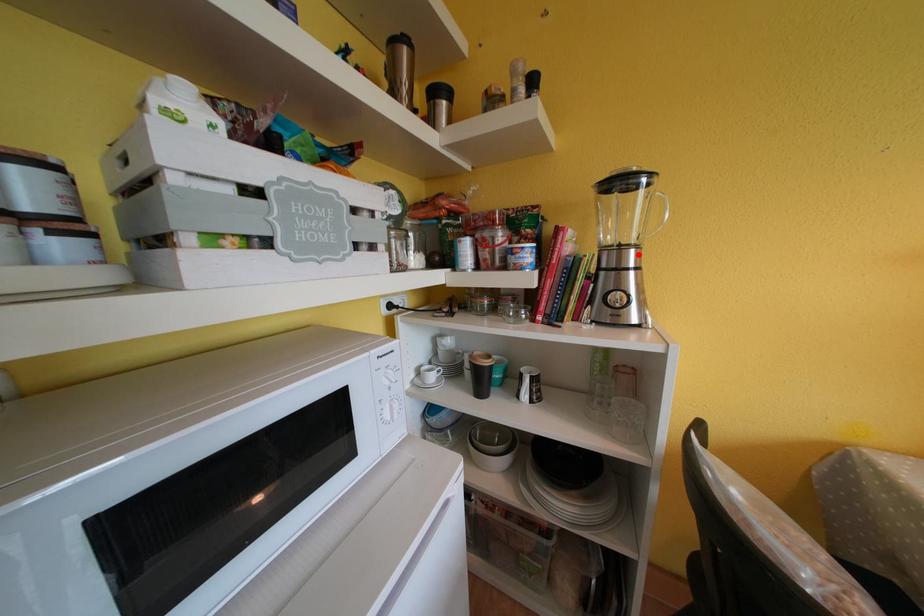
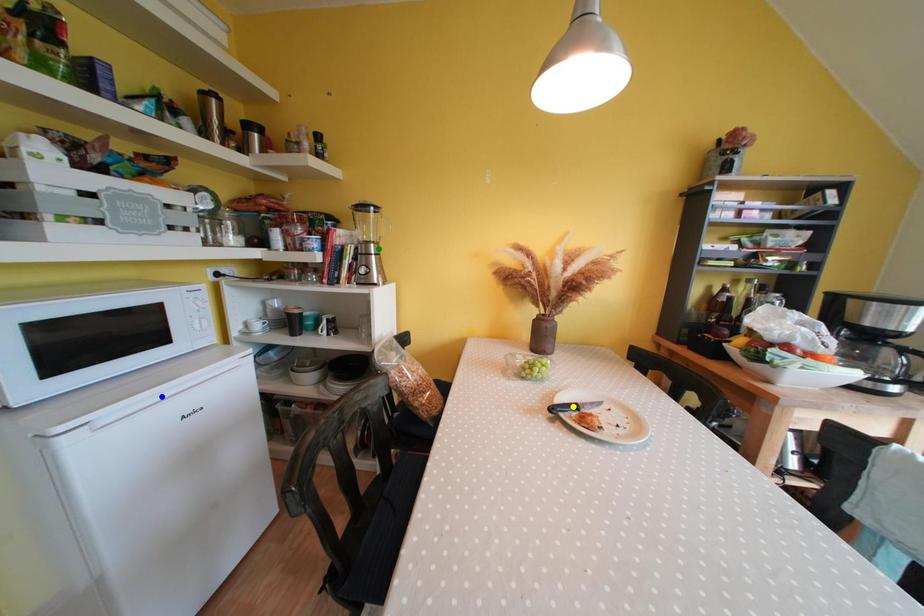
Question: I am providing you with two images of the same scene from different viewpoints. A red point is marked on the first image. You are given multiple points on the second image. Which mark in image 2 goes with the point in image 1?

Choices:
 (A) yellow point
 (B) blue point
 (C) green point

Answer: (C)